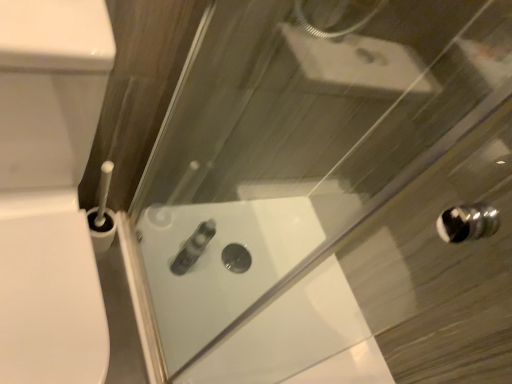
This screenshot has width=512, height=384. What are the coordinates of `satin silver tube at center` in the screenshot? It's located at (193, 247).

At what (x,y) coordinates should I click in order to perform the action: click on white glossy bath at center. Please return your answer as a coordinate pair (x, y). Looking at the image, I should click on (220, 265).

Which is behind, point (37, 19) or point (244, 244)?

The point (244, 244) is farther.

Between white glossy toilet at left and white glossy bath at center, which one appears on the right side from the viewer's perspective?

Positioned to the right is white glossy bath at center.

From the image's perspective, between white glossy toilet at left and white glossy bath at center, which one is located above?

white glossy toilet at left is shown above in the image.

Between white glossy toilet at left and satin silver tube at center, which one has larger width?

With larger width is white glossy toilet at left.

Considering the points (41, 221) and (180, 271), which point is in front, point (41, 221) or point (180, 271)?

The point (41, 221) is closer.

From their relative heights in the image, would you say white glossy toilet at left is taller or shorter than satin silver tube at center?

white glossy toilet at left is taller than satin silver tube at center.

Considering their positions, is white glossy toilet at left located in front of or behind satin silver tube at center?

white glossy toilet at left is positioned closer to the viewer than satin silver tube at center.

Is white glossy bath at center aimed at satin silver tube at center?

No, white glossy bath at center is not oriented towards satin silver tube at center.

From a real-world perspective, who is located lower, white glossy bath at center or satin silver tube at center?

From a 3D spatial view, white glossy bath at center is below.

Who is bigger, white glossy bath at center or satin silver tube at center?

white glossy bath at center.

Is point (207, 289) closer or farther from the camera than point (170, 268)?

Point (207, 289) appears to be farther away from the viewer than point (170, 268).

How different are the orientations of white glossy bath at center and white glossy toilet at left in degrees?

They differ by 92 degrees in their facing directions.

Is white glossy bath at center completely or partially outside of white glossy toilet at left?

white glossy bath at center lies outside white glossy toilet at left's area.

Based on the photo, which object is closer to the camera taking this photo, white glossy bath at center or white glossy toilet at left?

white glossy toilet at left.

Looking at the image, does white glossy bath at center seem bigger or smaller compared to white glossy toilet at left?

Clearly, white glossy bath at center is smaller in size than white glossy toilet at left.

From the picture: Is satin silver tube at center positioned before white glossy bath at center?

No.

Is satin silver tube at center far away from white glossy bath at center?

satin silver tube at center is actually quite close to white glossy bath at center.

Is satin silver tube at center at the right side of white glossy bath at center?

No, satin silver tube at center is not to the right of white glossy bath at center.

Does point (178, 260) lie behind point (176, 293)?

Yes, point (178, 260) is behind point (176, 293).

Locate an element on the screen. This screenshot has height=384, width=512. porcelain located above the satin silver tube at center (from the image's perspective) is located at coordinates (50, 190).

Is satin silver tube at center far from white glossy toilet at left?

Actually, satin silver tube at center and white glossy toilet at left are a little close together.

Can you confirm if satin silver tube at center is bigger than white glossy toilet at left?

Actually, satin silver tube at center might be smaller than white glossy toilet at left.

From the image's perspective, which object appears higher, satin silver tube at center or white glossy toilet at left?

white glossy toilet at left is shown above in the image.

This screenshot has height=384, width=512. There is a white glossy bath at center. Identify the location of porcelain above it (from a real-world perspective). (50, 190).

Identify the location of toiletry below the white glossy toilet at left (from the image's perspective). The width and height of the screenshot is (512, 384). point(193,247).

In the scene shown: Considering their positions, is white glossy bath at center positioned further to satin silver tube at center than white glossy toilet at left?

white glossy toilet at left.

From the image, which object appears to be nearer to white glossy toilet at left, satin silver tube at center or white glossy bath at center?

white glossy bath at center is closer to white glossy toilet at left.

Looking at the image, which one is located further to white glossy bath at center, satin silver tube at center or white glossy toilet at left?

white glossy toilet at left is positioned further to the anchor white glossy bath at center.

Based on their spatial positions, is white glossy toilet at left or white glossy bath at center further from satin silver tube at center?

white glossy toilet at left.

Based on the photo, when comparing their distances from white glossy bath at center, does white glossy toilet at left or satin silver tube at center seem closer?

satin silver tube at center is closer to white glossy bath at center.

Based on their spatial positions, is white glossy bath at center or satin silver tube at center further from white glossy toilet at left?

satin silver tube at center lies further to white glossy toilet at left than the other object.

What are the coordinates of `bath between white glossy toilet at left and satin silver tube at center from front to back` in the screenshot? It's located at (220, 265).